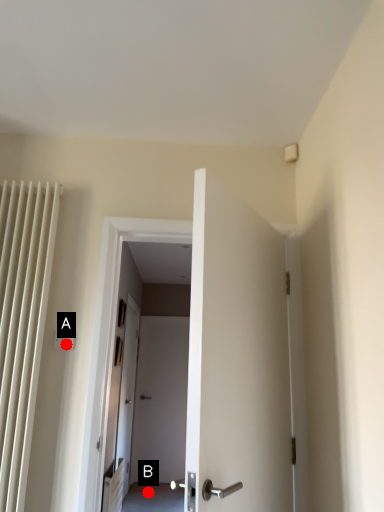
Question: Two points are circled on the image, labeled by A and B beside each circle. Which of the following is the farthest from the observer?

Choices:
 (A) A is further
 (B) B is further

Answer: (B)